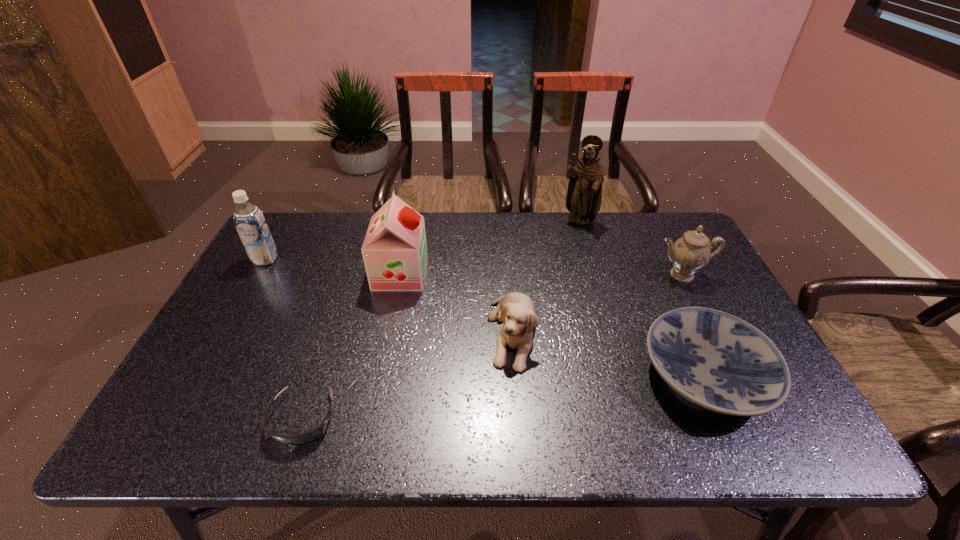
This screenshot has width=960, height=540. In order to click on object that is the closest to the third shortest object in this screenshot , I will do `click(394, 250)`.

Identify the location of the third closest object to the sixth tallest object. This screenshot has height=540, width=960. (584, 194).

Image resolution: width=960 pixels, height=540 pixels. In order to click on vacant space that satisfies the following two spatial constraints: 1. on the front-facing side of the puppy; 2. on the right side of the plate in this screenshot , I will do click(x=515, y=375).

The width and height of the screenshot is (960, 540). Find the location of `free space that satisfies the following two spatial constraints: 1. with the cap open on the right soya milk; 2. on the lenses of the shortest object`. free space that satisfies the following two spatial constraints: 1. with the cap open on the right soya milk; 2. on the lenses of the shortest object is located at coordinates (372, 418).

Find the location of a particular element. free region that satisfies the following two spatial constraints: 1. with the cap open on the fifth object from right to left; 2. on the lenses of the shortest object is located at coordinates (372, 418).

Where is `vacant space that satisfies the following two spatial constraints: 1. on the back side of the plate; 2. with the cap open on the right soya milk`? The image size is (960, 540). vacant space that satisfies the following two spatial constraints: 1. on the back side of the plate; 2. with the cap open on the right soya milk is located at coordinates (660, 274).

I want to click on free space that satisfies the following two spatial constraints: 1. on the front-facing side of the fourth object from right to left; 2. on the right side of the plate, so click(515, 375).

At what (x,y) coordinates should I click in order to perform the action: click on free space that satisfies the following two spatial constraints: 1. on the label of the sixth tallest object; 2. on the right side of the leftmost object. Please return your answer as a coordinate pair (x, y). This screenshot has height=540, width=960. Looking at the image, I should click on (201, 375).